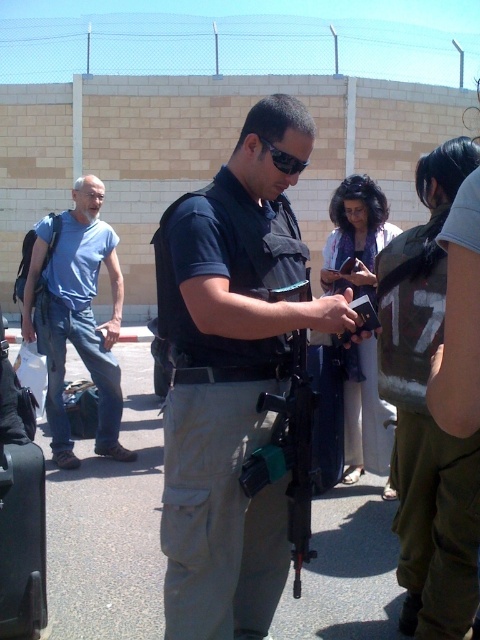
You are a security officer at the checkpoint. You notice two items in your vicinity. One is blue denim jeans at left and the other is black plastic sunglasses at center. Which item is positioned lower in the image?

The blue denim jeans at left is positioned below the black plastic sunglasses at center, so the blue denim jeans at left is lower in the image.

You are a traveler who just arrived at the checkpoint. You see the matte black vest at center. Where is it located in the image?

The matte black vest at center is located at point 0.591 on the horizontal axis and 0.481 on the vertical axis.